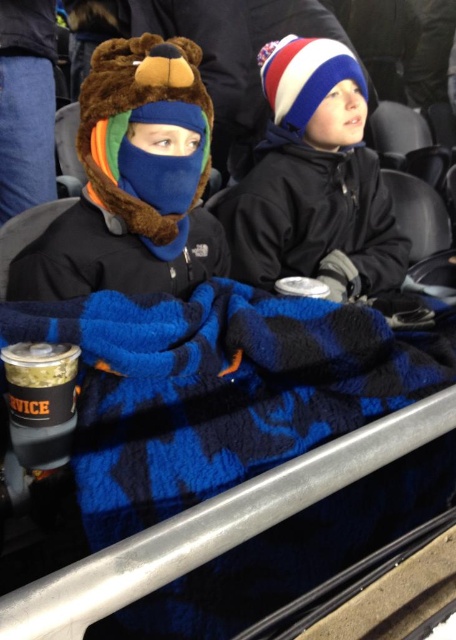
Based on the coordinates provided, which object is located at point (218, 388) in the image?

The blue fleece blanket at lower center is located at point (218, 388).

Consider the image. You are sitting in the stadium and want to place a small snack between the two points, point (392, 358) and point (107, 196). Which point should you choose to ensure the snack is closer to you?

You should place the snack closer to point (392, 358) because it is closer to the viewer than point (107, 196).